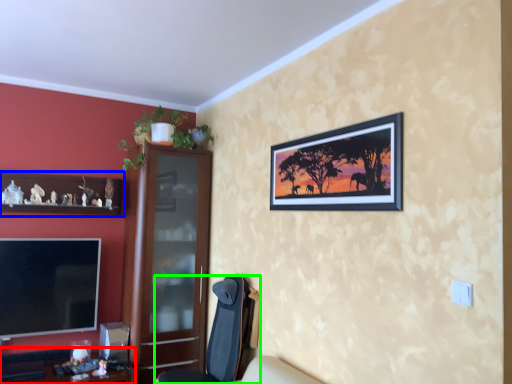
Question: Considering the real-world distances, which object is closest to desk (highlighted by a red box)? cabinetry (highlighted by a blue box) or chair (highlighted by a green box).

Choices:
 (A) cabinetry
 (B) chair

Answer: (B)